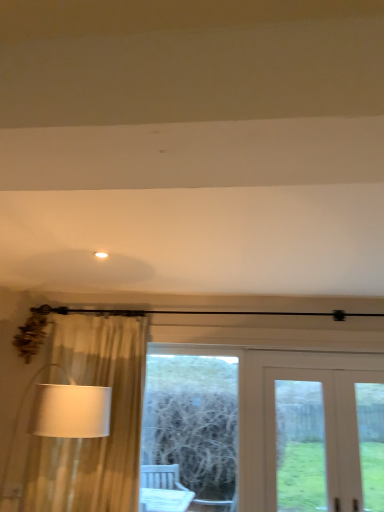
Question: Based on their sizes in the image, would you say white wooden door at center is bigger or smaller than white fabric lampshade at left?

Choices:
 (A) small
 (B) big

Answer: (A)

Question: Is white wooden door at center inside or outside of white fabric lampshade at left?

Choices:
 (A) outside
 (B) inside

Answer: (A)

Question: Which object is the farthest from the white wooden door at center?

Choices:
 (A) white fabric lampshade at left
 (B) wooden frame at center
 (C) white matte light fixture at upper center

Answer: (C)

Question: Based on their relative distances, which object is nearer to the white matte light fixture at upper center?

Choices:
 (A) white wooden door at center
 (B) wooden frame at center
 (C) white fabric lampshade at left

Answer: (C)